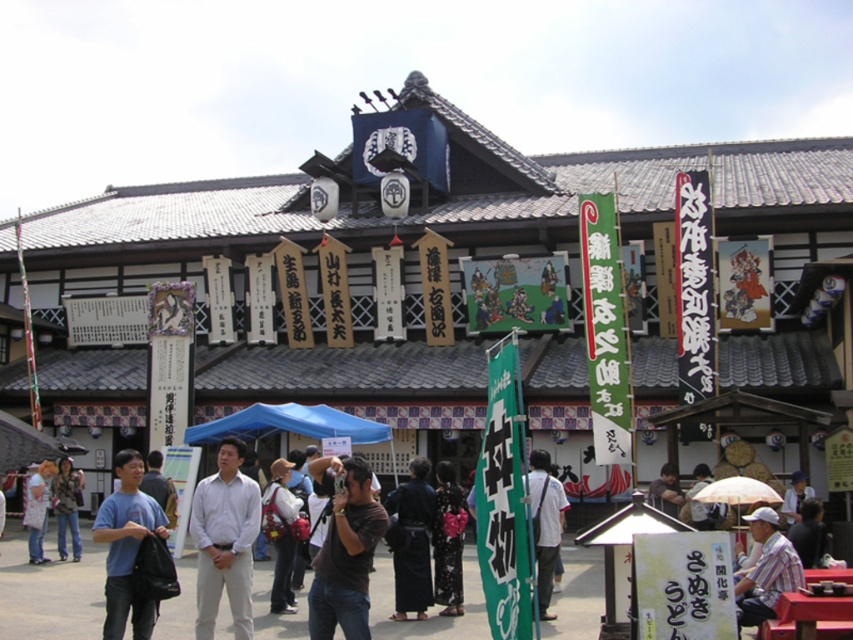
You are a photographer at the festival and want to take a photo of both the dark brown fabric camera at center and the black silk kimono at center in the same frame. Given that your camera has a 50mm lens with a field of view that can capture objects up to 25 feet apart, will you be able to include both in the photo?

The dark brown fabric camera at center and the black silk kimono at center are 30.01 feet apart. Since the maximum distance your camera can capture is 25 feet, you will not be able to include both in the same frame.